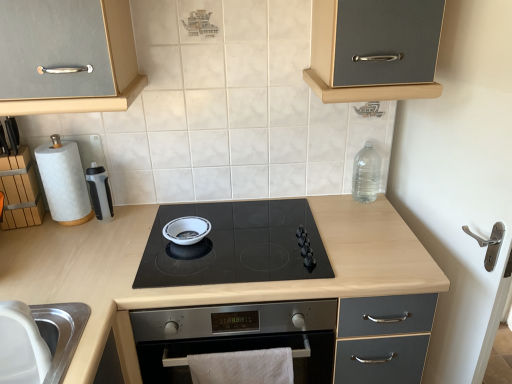
I want to click on blank space situated above black glass cooktop at center (from a real-world perspective), so click(218, 250).